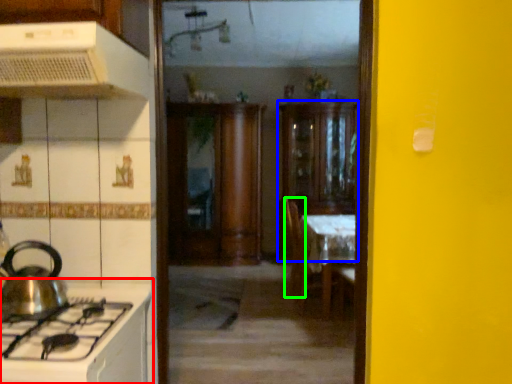
Question: Considering the real-world distances, which object is closest to countertop (highlighted by a red box)? cabinetry (highlighted by a blue box) or chair (highlighted by a green box).

Choices:
 (A) cabinetry
 (B) chair

Answer: (B)